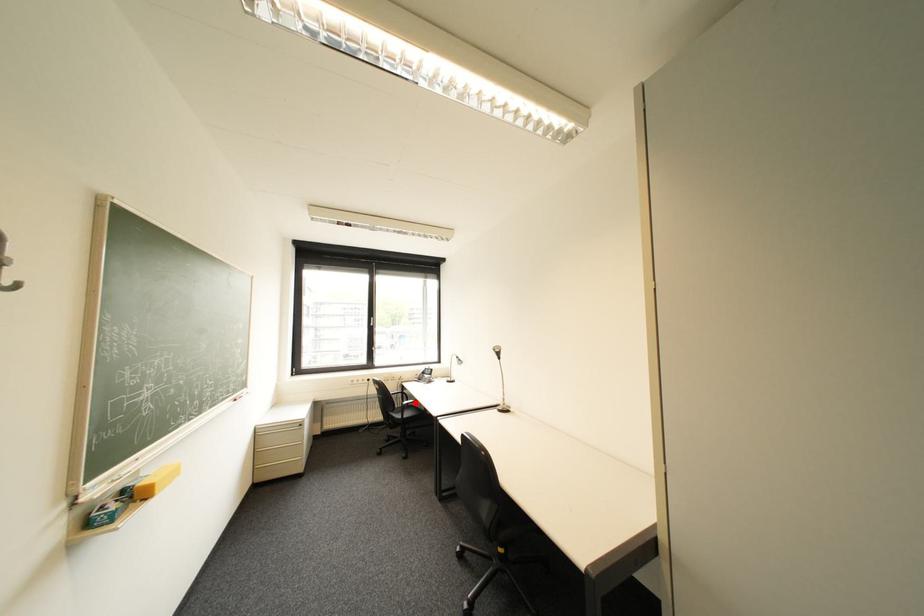
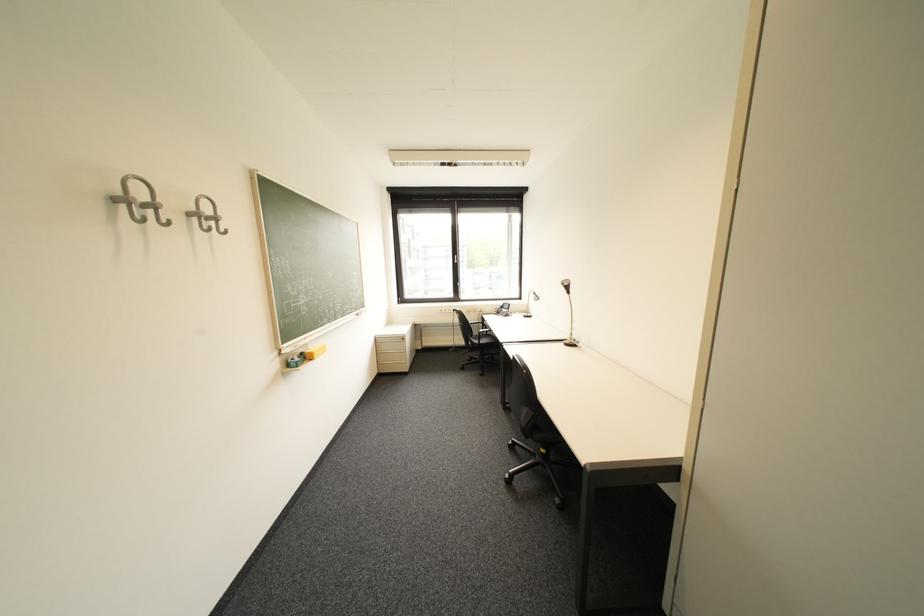
Find the pixel in the second image that matches the highlighted location in the first image.

(492, 331)